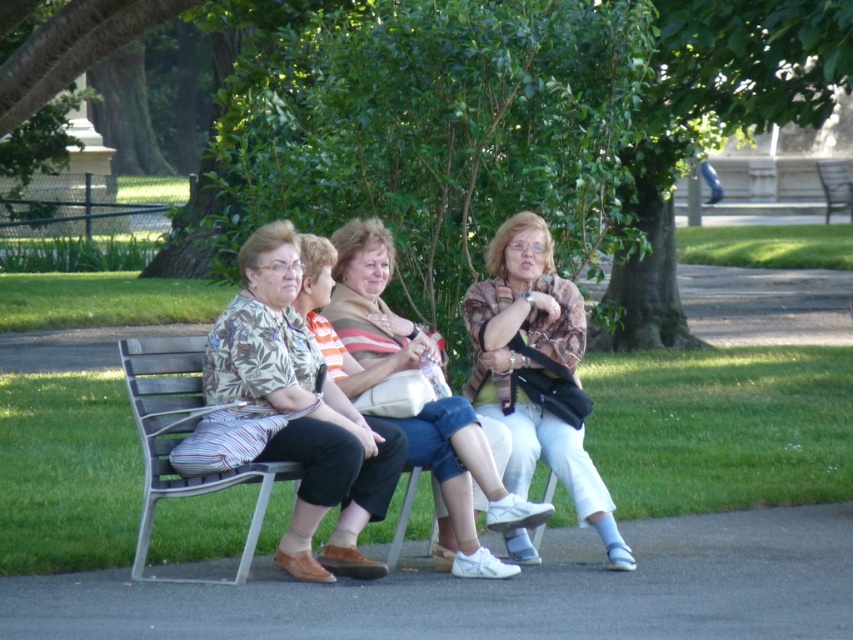
You are taking a photo of the park bench scene. You want to focus on the point at point (500, 481) and point (824, 177). Which point is closer to your camera?

Point (500, 481) is closer to the camera than point (824, 177).

You are a photographer trying to capture a candid shot of the striped fabric purse at center and the wooden park bench at right. Based on their positions, which object is closer to the photographer?

The striped fabric purse at center is positioned on the left side of wooden park bench at right, meaning it is closer to the photographer than the bench.

You are standing at the point marked by the coordinate point (x=715, y=122) in the image. Looking around, you see a green leafy tree at center. Which direction should you walk to reach the park bench where the four women are sitting?

The point (x=715, y=122) marks the green leafy tree at center. The park bench is located under the shade of trees, so you should walk towards the direction where the women are sitting under the tree, which would be away from the marked point towards the bench area.